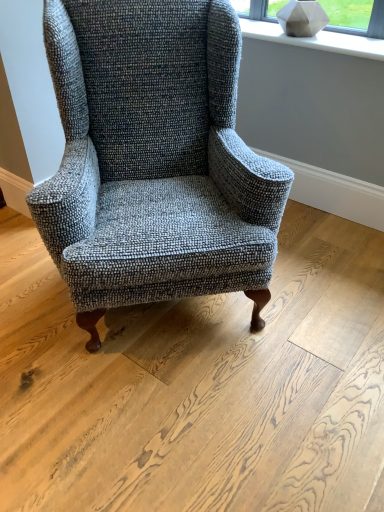
This screenshot has width=384, height=512. What do you see at coordinates (316, 40) in the screenshot?
I see `white matte stone at upper center` at bounding box center [316, 40].

Find the location of `white matte stone at upper center`. white matte stone at upper center is located at coordinates (316, 40).

Where is `textured gray wingback chair at center`? textured gray wingback chair at center is located at coordinates (153, 158).

What is the approximate width of textured gray wingback chair at center?

textured gray wingback chair at center is 33.68 inches in width.

This screenshot has width=384, height=512. Describe the element at coordinates (153, 158) in the screenshot. I see `textured gray wingback chair at center` at that location.

Identify the location of white matte stone at upper center. [316, 40].

Based on their positions, is textured gray wingback chair at center located to the left or right of white matte stone at upper center?

textured gray wingback chair at center is to the left of white matte stone at upper center.

Which object is further away from the camera, textured gray wingback chair at center or white matte stone at upper center?

Positioned behind is white matte stone at upper center.

Which point is more forward, (x=94, y=139) or (x=364, y=45)?

The point (x=94, y=139) is in front.

From the image's perspective, which is above, textured gray wingback chair at center or white matte stone at upper center?

white matte stone at upper center.

From a real-world perspective, is textured gray wingback chair at center physically located above or below white matte stone at upper center?

In terms of real-world spatial position, textured gray wingback chair at center is below white matte stone at upper center.

Between textured gray wingback chair at center and white matte stone at upper center, which one has larger width?

textured gray wingback chair at center is wider.

Who is taller, textured gray wingback chair at center or white matte stone at upper center?

Standing taller between the two is textured gray wingback chair at center.

Based on the photo, considering the sizes of textured gray wingback chair at center and white matte stone at upper center in the image, is textured gray wingback chair at center bigger or smaller than white matte stone at upper center?

In the image, textured gray wingback chair at center appears to be larger than white matte stone at upper center.

Is white matte stone at upper center inside textured gray wingback chair at center?

Actually, white matte stone at upper center is outside textured gray wingback chair at center.

Is textured gray wingback chair at center not close to white matte stone at upper center?

No, textured gray wingback chair at center is not far from white matte stone at upper center.

Is textured gray wingback chair at center facing away from white matte stone at upper center?

textured gray wingback chair at center does not have its back to white matte stone at upper center.

How many degrees apart are the facing directions of textured gray wingback chair at center and white matte stone at upper center?

textured gray wingback chair at center and white matte stone at upper center are facing 48.9 degrees away from each other.

Based on the photo, measure the distance between textured gray wingback chair at center and white matte stone at upper center.

The distance of textured gray wingback chair at center from white matte stone at upper center is 90.59 centimeters.

The height and width of the screenshot is (512, 384). I want to click on window sill on the right of textured gray wingback chair at center, so click(x=316, y=40).

Between white matte stone at upper center and textured gray wingback chair at center, which one appears on the left side from the viewer's perspective?

textured gray wingback chair at center is more to the left.

Considering the positions of objects white matte stone at upper center and textured gray wingback chair at center in the image provided, who is in front, white matte stone at upper center or textured gray wingback chair at center?

textured gray wingback chair at center is more forward.

Is point (304, 44) closer or farther from the camera than point (168, 269)?

Point (304, 44) appears to be farther away from the viewer than point (168, 269).

From the image's perspective, which one is positioned lower, white matte stone at upper center or textured gray wingback chair at center?

textured gray wingback chair at center.

Consider the image. From a real-world perspective, which is physically below, white matte stone at upper center or textured gray wingback chair at center?

textured gray wingback chair at center, from a real-world perspective.

Can you confirm if white matte stone at upper center is wider than textured gray wingback chair at center?

No.

Can you confirm if white matte stone at upper center is taller than textured gray wingback chair at center?

No.

Which of these two, white matte stone at upper center or textured gray wingback chair at center, is bigger?

textured gray wingback chair at center.

Which is correct: white matte stone at upper center is inside textured gray wingback chair at center, or outside of it?

white matte stone at upper center lies outside textured gray wingback chair at center.

Is white matte stone at upper center positioned far away from textured gray wingback chair at center?

They are positioned close to each other.

Is white matte stone at upper center aimed at textured gray wingback chair at center?

Yes, white matte stone at upper center is aimed at textured gray wingback chair at center.

Image resolution: width=384 pixels, height=512 pixels. I want to click on window sill that is above the textured gray wingback chair at center (from a real-world perspective), so click(316, 40).

I want to click on window sill that is on the right side of textured gray wingback chair at center, so click(316, 40).

I want to click on window sill above the textured gray wingback chair at center (from the image's perspective), so click(316, 40).